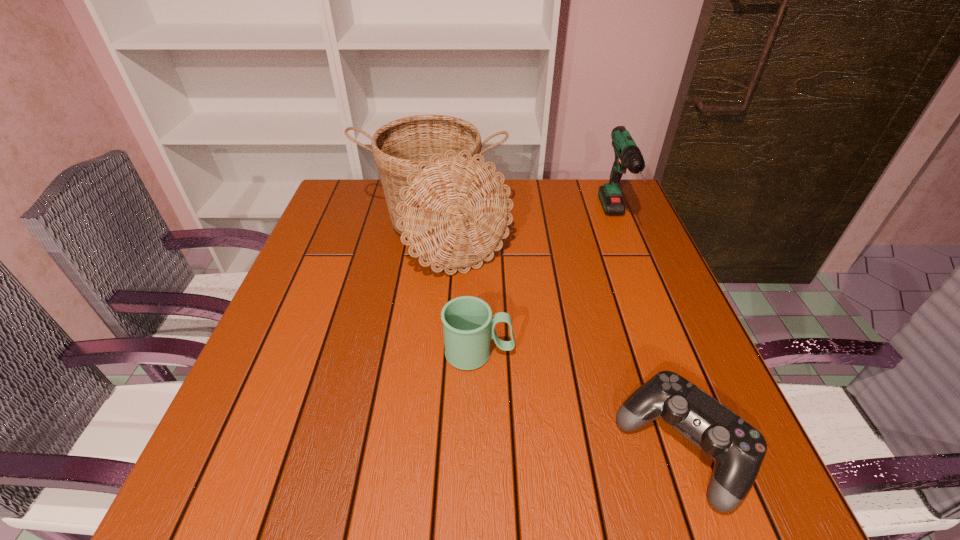
Where is `empty space between the drill and the control`? The width and height of the screenshot is (960, 540). empty space between the drill and the control is located at coordinates (649, 334).

Identify the location of free space between the basket and the nearest object. (559, 341).

The height and width of the screenshot is (540, 960). Identify the location of free area in between the basket and the shortest object. (559, 341).

Locate an element on the screen. vacant area that lies between the drill and the second nearest object is located at coordinates (547, 287).

At what (x,y) coordinates should I click in order to perform the action: click on free spot between the mug and the second tallest object. Please return your answer as a coordinate pair (x, y). The image size is (960, 540). Looking at the image, I should click on (547, 287).

Find the location of a particular element. The width and height of the screenshot is (960, 540). empty location between the basket and the third shortest object is located at coordinates (525, 227).

Identify which object is the third closest to the control. Please provide its 2D coordinates. Your answer should be formatted as a tuple, i.e. [(x, y)], where the tuple contains the x and y coordinates of a point satisfying the conditions above.

[(628, 156)]

Choose which object is the nearest neighbor to the drill. Please provide its 2D coordinates. Your answer should be formatted as a tuple, i.e. [(x, y)], where the tuple contains the x and y coordinates of a point satisfying the conditions above.

[(452, 208)]

Find the location of a particular element. The width and height of the screenshot is (960, 540). vacant space that satisfies the following two spatial constraints: 1. on the side of the mug with the handle; 2. on the left side of the control is located at coordinates (479, 448).

What are the coordinates of `free point that satisfies the following two spatial constraints: 1. on the side of the third tallest object with the handle; 2. on the back side of the control` in the screenshot? It's located at (479, 448).